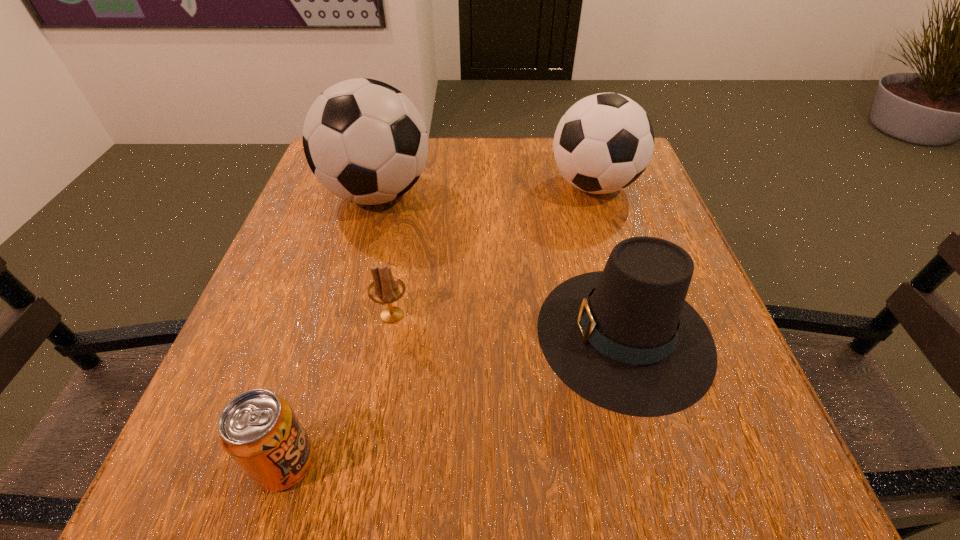
Where is `blank space located on the front-facing side of the third tallest object`? This screenshot has width=960, height=540. blank space located on the front-facing side of the third tallest object is located at coordinates tap(366, 334).

I want to click on free location located on the front-facing side of the third tallest object, so click(443, 334).

Image resolution: width=960 pixels, height=540 pixels. I want to click on free location located 0.150m on the back of the candle holder, so click(404, 246).

I want to click on object situated at the near edge, so click(258, 429).

You are a GUI agent. You are given a task and a screenshot of the screen. Output one action in this format:
    pyautogui.click(x=<x>, y=<y>)
    Task: Click on the soccer ball at the left edge
    The image size is (960, 540).
    Given the screenshot: What is the action you would take?
    pyautogui.click(x=365, y=141)

This screenshot has height=540, width=960. I want to click on soda can that is at the left edge, so click(258, 429).

I want to click on soccer ball positioned at the right edge, so click(604, 142).

This screenshot has height=540, width=960. In order to click on hat located in the right edge section of the desktop in this screenshot , I will do `click(625, 339)`.

Identify the location of object positioned at the far left corner. (365, 141).

The height and width of the screenshot is (540, 960). In order to click on object present at the near left corner in this screenshot , I will do `click(258, 429)`.